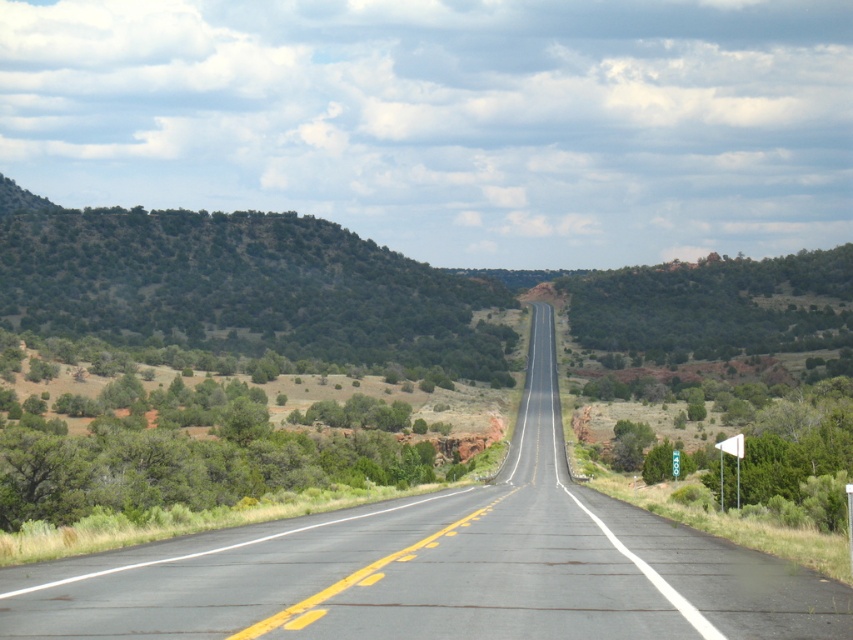
Identify the location of asphalt road at center. This screenshot has height=640, width=853. (440, 566).

Who is taller, asphalt road at center or green shrubbery at left?

Standing taller between the two is green shrubbery at left.

Between point (184, 605) and point (335, 358), which one is positioned behind?

The point (335, 358) is behind.

The height and width of the screenshot is (640, 853). I want to click on asphalt road at center, so click(x=440, y=566).